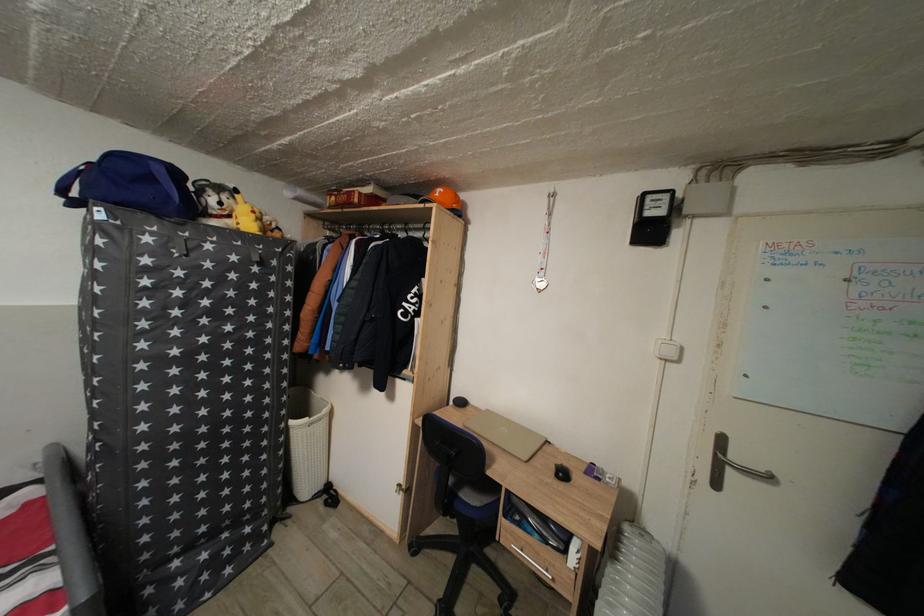
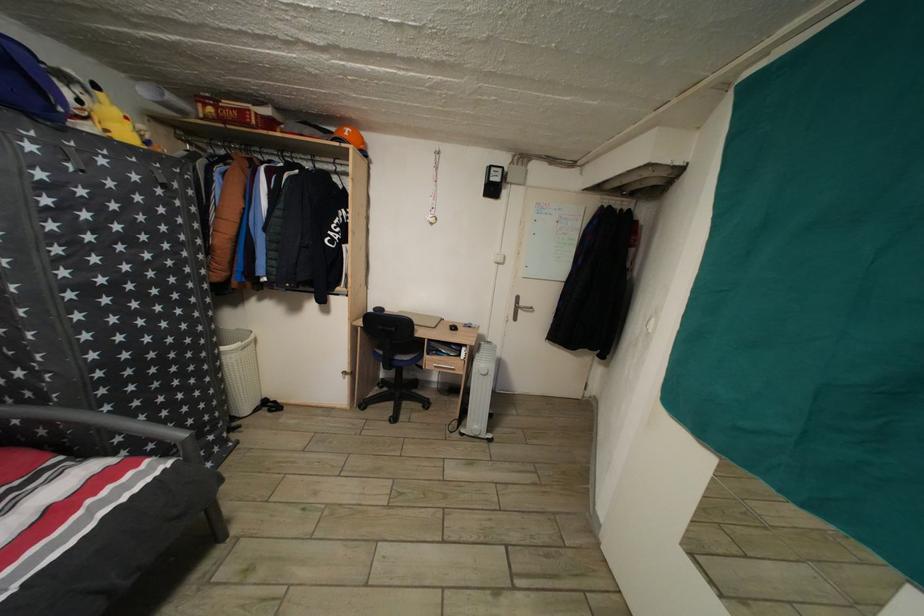
Locate, in the second image, the point that corresponds to the point at 298,429 in the first image.

(229, 355)